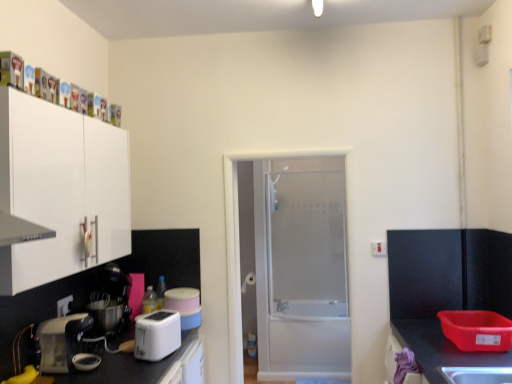
Where is `white frosted glass door at center`? The width and height of the screenshot is (512, 384). white frosted glass door at center is located at coordinates (293, 264).

What do you see at coordinates (63, 190) in the screenshot? This screenshot has width=512, height=384. I see `white matte cabinet at upper left` at bounding box center [63, 190].

What is the approximate width of white plastic electric outlet at upper right, the 1th electric outlet viewed from the back?

white plastic electric outlet at upper right, the 1th electric outlet viewed from the back, is 0.82 inches wide.

The width and height of the screenshot is (512, 384). Find the location of `black matte countertop at lower right`. black matte countertop at lower right is located at coordinates (440, 348).

Measure the distance between point (458, 360) and camera.

Point (458, 360) and camera are 6.76 feet apart.

What do you see at coordinates (184, 306) in the screenshot? I see `white plastic toaster at lower center, which is counted as the 2th appliance, starting from the left` at bounding box center [184, 306].

Where is `white frosted glass door at center`? This screenshot has width=512, height=384. white frosted glass door at center is located at coordinates (293, 264).

How many degrees apart are the facing directions of white plastic toaster at lower center, which is counted as the 2th appliance, starting from the left, and white frosted glass door at center?

61.9 degrees separate the facing orientations of white plastic toaster at lower center, which is counted as the 2th appliance, starting from the left, and white frosted glass door at center.

Is white plastic toaster at lower center, which is counted as the 2th appliance, starting from the left, in front of or behind white frosted glass door at center in the image?

Clearly, white plastic toaster at lower center, which is counted as the 2th appliance, starting from the left, is in front of white frosted glass door at center.

Is white frosted glass door at center located within white plastic toaster at lower center, the first appliance positioned from the right?

Actually, white frosted glass door at center is outside white plastic toaster at lower center, the first appliance positioned from the right.

In the scene shown: Is white plastic toaster at lower center, which is counted as the 2th appliance, starting from the left, to the right of white frosted glass door at center from the viewer's perspective?

In fact, white plastic toaster at lower center, which is counted as the 2th appliance, starting from the left, is to the left of white frosted glass door at center.

Which is more to the left, matte black mixer at lower left, the first appliance when ordered from left to right, or black matte countertop at lower right?

matte black mixer at lower left, the first appliance when ordered from left to right.

Is matte black mixer at lower left, the first appliance when ordered from left to right, facing away from black matte countertop at lower right?

No, matte black mixer at lower left, the first appliance when ordered from left to right, is not facing away from black matte countertop at lower right.

Between matte black mixer at lower left, placed as the second appliance when sorted from right to left, and black matte countertop at lower right, which one has larger width?

black matte countertop at lower right is wider.

Which of these two, matte black mixer at lower left, placed as the second appliance when sorted from right to left, or black matte countertop at lower right, stands taller?

black matte countertop at lower right.

From the picture: Is matte black mixer at lower left, the first appliance when ordered from left to right, spatially inside white plastic toaster at lower left, which is the second kitchen appliance from right to left, or outside of it?

matte black mixer at lower left, the first appliance when ordered from left to right, is not enclosed by white plastic toaster at lower left, which is the second kitchen appliance from right to left.

Where is `the 1st appliance to the right of the white plastic toaster at lower left, the 1th kitchen appliance in the left-to-right sequence, starting your count from the anchor`? This screenshot has height=384, width=512. the 1st appliance to the right of the white plastic toaster at lower left, the 1th kitchen appliance in the left-to-right sequence, starting your count from the anchor is located at coordinates (110, 301).

How much distance is there between matte black mixer at lower left, the first appliance when ordered from left to right, and white plastic toaster at lower left, which is the second kitchen appliance from right to left?

matte black mixer at lower left, the first appliance when ordered from left to right, is 9.80 inches away from white plastic toaster at lower left, which is the second kitchen appliance from right to left.

From the picture: Considering the relative positions of matte black mixer at lower left, placed as the second appliance when sorted from right to left, and white plastic toaster at lower left, which is the second kitchen appliance from right to left, in the image provided, is matte black mixer at lower left, placed as the second appliance when sorted from right to left, behind white plastic toaster at lower left, which is the second kitchen appliance from right to left,?

That is True.

Measure the distance between black matte countertop at lower right and white plastic electric outlet at upper right, marked as the 2th electric outlet in a left-to-right arrangement.

black matte countertop at lower right is 27.31 inches away from white plastic electric outlet at upper right, marked as the 2th electric outlet in a left-to-right arrangement.

From a real-world perspective, who is located lower, black matte countertop at lower right or white plastic electric outlet at upper right, the 1th electric outlet from the right?

In real-world perspective, black matte countertop at lower right is lower.

Could you tell me if black matte countertop at lower right is turned towards white plastic electric outlet at upper right, which is the 2th electric outlet in bottom-to-top order?

No, black matte countertop at lower right is not facing towards white plastic electric outlet at upper right, which is the 2th electric outlet in bottom-to-top order.

The height and width of the screenshot is (384, 512). What are the coordinates of `countertop that is below the white plastic electric outlet at upper right, which is the second electric outlet from front to back (from the image's perspective)` in the screenshot? It's located at (440, 348).

At what (x,y) coordinates should I click in order to perform the action: click on kitchen appliance lying behind the white plastic toaster at lower left, the 1th kitchen appliance in the left-to-right sequence. Please return your answer as a coordinate pair (x, y). The width and height of the screenshot is (512, 384). Looking at the image, I should click on (157, 335).

Considering the sizes of objects white plastic toaster at lower left, which is the second kitchen appliance from left to right, and white plastic toaster at lower left, the 1th kitchen appliance in the left-to-right sequence, in the image provided, who is wider, white plastic toaster at lower left, which is the second kitchen appliance from left to right, or white plastic toaster at lower left, the 1th kitchen appliance in the left-to-right sequence,?

white plastic toaster at lower left, the 1th kitchen appliance in the left-to-right sequence.

Who is taller, white plastic toaster at lower left, which is the second kitchen appliance from left to right, or white plastic toaster at lower left, which is the second kitchen appliance from right to left?

white plastic toaster at lower left, which is the second kitchen appliance from right to left, is taller.

Is white plastic toaster at lower left, the 1th kitchen appliance in the left-to-right sequence, surrounded by white plastic toaster at lower left, which is the second kitchen appliance from left to right?

No, white plastic toaster at lower left, the 1th kitchen appliance in the left-to-right sequence, is not a part of white plastic toaster at lower left, which is the second kitchen appliance from left to right.

Is matte black mixer at lower left, placed as the second appliance when sorted from right to left, a part of white plastic electric outlet at upper right, the 1th electric outlet from the right?

That's incorrect, matte black mixer at lower left, placed as the second appliance when sorted from right to left, is not inside white plastic electric outlet at upper right, the 1th electric outlet from the right.

Considering the relative positions of white plastic electric outlet at upper right, which is the 2th electric outlet in bottom-to-top order, and matte black mixer at lower left, placed as the second appliance when sorted from right to left, in the image provided, is white plastic electric outlet at upper right, which is the 2th electric outlet in bottom-to-top order, to the left of matte black mixer at lower left, placed as the second appliance when sorted from right to left, from the viewer's perspective?

In fact, white plastic electric outlet at upper right, which is the 2th electric outlet in bottom-to-top order, is to the right of matte black mixer at lower left, placed as the second appliance when sorted from right to left.

Who is shorter, white plastic electric outlet at upper right, which is the second electric outlet from front to back, or matte black mixer at lower left, placed as the second appliance when sorted from right to left?

With less height is white plastic electric outlet at upper right, which is the second electric outlet from front to back.

Which point is more forward, [379,253] or [130,290]?

The point [130,290] is in front.

Is white plastic toaster at lower left, which is the second kitchen appliance from left to right, positioned behind white plastic toaster at lower center, which is counted as the 2th appliance, starting from the left?

No.

Which is more to the left, white plastic toaster at lower left, which is the second kitchen appliance from left to right, or white plastic toaster at lower center, which is counted as the 2th appliance, starting from the left?

white plastic toaster at lower left, which is the second kitchen appliance from left to right.

Image resolution: width=512 pixels, height=384 pixels. What are the coordinates of `the 1st kitchen appliance in front of the white plastic toaster at lower center, the first appliance positioned from the right` in the screenshot? It's located at (157, 335).

Who is taller, white plastic toaster at lower left, which is the second kitchen appliance from left to right, or white plastic toaster at lower center, the first appliance positioned from the right?

Standing taller between the two is white plastic toaster at lower left, which is the second kitchen appliance from left to right.

From the image's perspective, count 2nd appliances downward from the white frosted glass door at center and point to it. Please provide its 2D coordinates.

[(184, 306)]

Image resolution: width=512 pixels, height=384 pixels. In the image, there is a matte black mixer at lower left, placed as the second appliance when sorted from right to left. Find the location of `countertop below it (from a real-world perspective)`. countertop below it (from a real-world perspective) is located at coordinates (440, 348).

Which object lies further to the anchor point white matte cabinet at upper left, white plastic electric outlet at upper right, which is the 2th electric outlet in bottom-to-top order, or white plastic toaster at lower left, which is the second kitchen appliance from right to left?

white plastic electric outlet at upper right, which is the 2th electric outlet in bottom-to-top order, lies further to white matte cabinet at upper left than the other object.

When comparing their distances from white plastic electric outlet at upper right, the 1th electric outlet from the right, does white plastic toaster at lower center, the first appliance positioned from the right, or white frosted glass door at center seem further?

white frosted glass door at center is further to white plastic electric outlet at upper right, the 1th electric outlet from the right.

Looking at the image, which one is located closer to white plastic electric outlet at lower left, positioned as the second electric outlet in back-to-front order, white plastic toaster at lower left, which is the second kitchen appliance from left to right, or white frosted glass door at center?

The object closer to white plastic electric outlet at lower left, positioned as the second electric outlet in back-to-front order, is white plastic toaster at lower left, which is the second kitchen appliance from left to right.

Considering their positions, is white frosted glass door at center positioned closer to white plastic toaster at lower left, the 1th kitchen appliance in the left-to-right sequence, than white plastic electric outlet at upper right, which is the second electric outlet from front to back?

white plastic electric outlet at upper right, which is the second electric outlet from front to back, is closer to white plastic toaster at lower left, the 1th kitchen appliance in the left-to-right sequence.

Estimate the real-world distances between objects in this image. Which object is further from white plastic toaster at lower left, which is the second kitchen appliance from left to right, white plastic toaster at lower left, which is the second kitchen appliance from right to left, or black matte countertop at lower right?

Among the two, black matte countertop at lower right is located further to white plastic toaster at lower left, which is the second kitchen appliance from left to right.

Estimate the real-world distances between objects in this image. Which object is further from white plastic toaster at lower left, the 1th kitchen appliance in the left-to-right sequence, white plastic toaster at lower center, which is counted as the 2th appliance, starting from the left, or matte black mixer at lower left, placed as the second appliance when sorted from right to left?

The object further to white plastic toaster at lower left, the 1th kitchen appliance in the left-to-right sequence, is white plastic toaster at lower center, which is counted as the 2th appliance, starting from the left.

From the image, which object appears to be nearer to white plastic electric outlet at upper right, marked as the 2th electric outlet in a left-to-right arrangement, white plastic toaster at lower left, the first kitchen appliance viewed from the right, or white matte cabinet at upper left?

white plastic toaster at lower left, the first kitchen appliance viewed from the right, lies closer to white plastic electric outlet at upper right, marked as the 2th electric outlet in a left-to-right arrangement, than the other object.

Based on their spatial positions, is matte black mixer at lower left, the first appliance when ordered from left to right, or white plastic toaster at lower left, which is the second kitchen appliance from right to left, further from white matte cabinet at upper left?

Among the two, white plastic toaster at lower left, which is the second kitchen appliance from right to left, is located further to white matte cabinet at upper left.

Identify the location of kitchen appliance located between matte black mixer at lower left, the first appliance when ordered from left to right, and white plastic electric outlet at upper right, which is the 2th electric outlet in bottom-to-top order, in the left-right direction. (157, 335).

Where is `appliance located between white plastic toaster at lower left, which is the second kitchen appliance from left to right, and white plastic electric outlet at upper right, marked as the 2th electric outlet in a left-to-right arrangement, in the left-right direction`? appliance located between white plastic toaster at lower left, which is the second kitchen appliance from left to right, and white plastic electric outlet at upper right, marked as the 2th electric outlet in a left-to-right arrangement, in the left-right direction is located at coordinates (184, 306).

Locate an element on the screen. This screenshot has height=384, width=512. electric outlet situated between white matte cabinet at upper left and black matte countertop at lower right from left to right is located at coordinates (379, 248).

The width and height of the screenshot is (512, 384). I want to click on appliance between matte black mixer at lower left, the first appliance when ordered from left to right, and white plastic electric outlet at upper right, which is the 2th electric outlet in bottom-to-top order, in the horizontal direction, so click(184, 306).